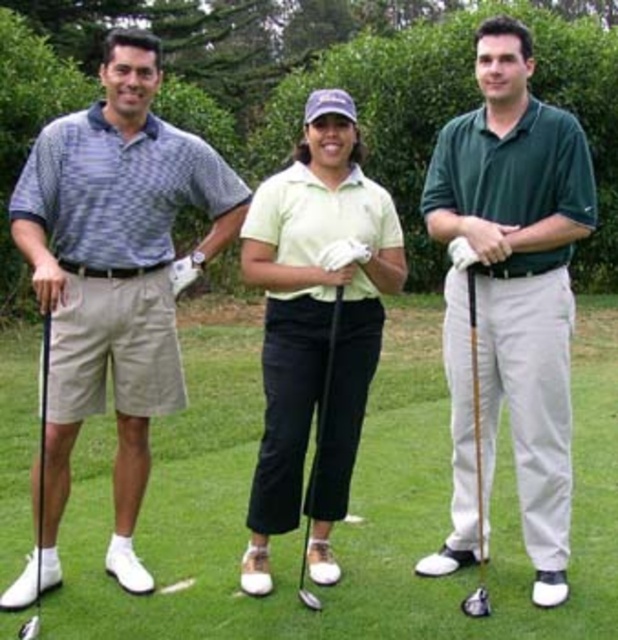
Can you confirm if green matte shirt at center is positioned below light green cotton polo shirt at center?

No.

Does green matte shirt at center have a lesser height compared to light green cotton polo shirt at center?

Incorrect, green matte shirt at center's height does not fall short of light green cotton polo shirt at center's.

Where is `green matte shirt at center`? The image size is (618, 640). green matte shirt at center is located at coordinates (519, 275).

Identify the location of green matte shirt at center. The image size is (618, 640). (519, 275).

Can you confirm if matte blue polo shirt at left is wider than wooden shaft golf club at center?

Indeed, matte blue polo shirt at left has a greater width compared to wooden shaft golf club at center.

Who is higher up, matte blue polo shirt at left or wooden shaft golf club at center?

matte blue polo shirt at left

Does point (69, 253) come behind point (472, 333)?

Yes, it is.

Where is `matte blue polo shirt at left`? Image resolution: width=618 pixels, height=640 pixels. matte blue polo shirt at left is located at coordinates tap(112, 282).

Who is positioned more to the right, light green cotton polo shirt at center or white leather golf club at left?

Positioned to the right is light green cotton polo shirt at center.

Can you confirm if light green cotton polo shirt at center is positioned above white leather golf club at left?

Yes.

Between point (277, 289) and point (36, 592), which one is positioned in front?

Point (36, 592) is in front.

Locate an element on the screen. light green cotton polo shirt at center is located at coordinates (315, 324).